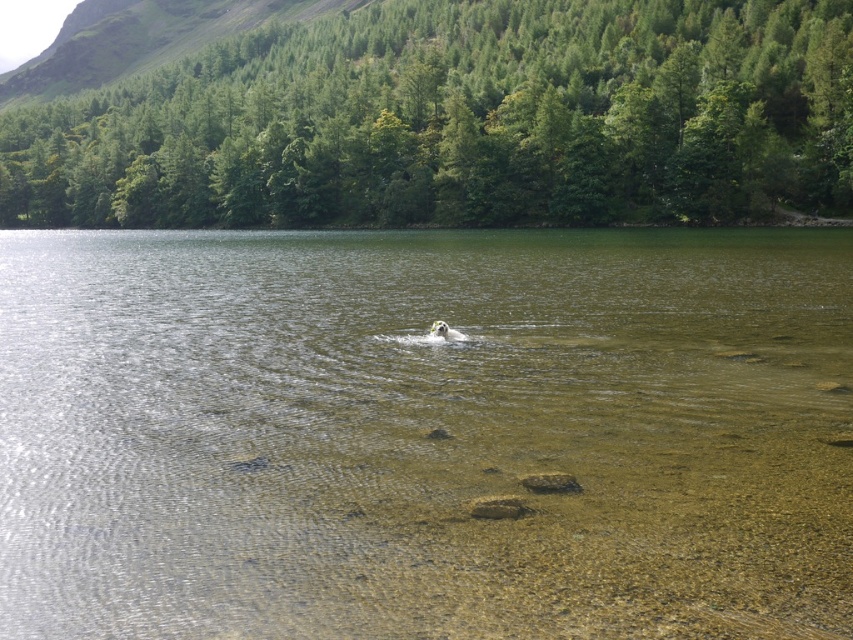
Question: Is clear water at center positioned before white fluffy dog at center?

Choices:
 (A) no
 (B) yes

Answer: (B)

Question: Does clear water at center have a lesser width compared to white fluffy dog at center?

Choices:
 (A) yes
 (B) no

Answer: (B)

Question: Which point is closer to the camera taking this photo?

Choices:
 (A) (448, 330)
 (B) (619, 499)

Answer: (B)

Question: Does clear water at center have a smaller size compared to white fluffy dog at center?

Choices:
 (A) yes
 (B) no

Answer: (B)

Question: Which point is farther to the camera?

Choices:
 (A) (436, 324)
 (B) (618, 374)

Answer: (A)